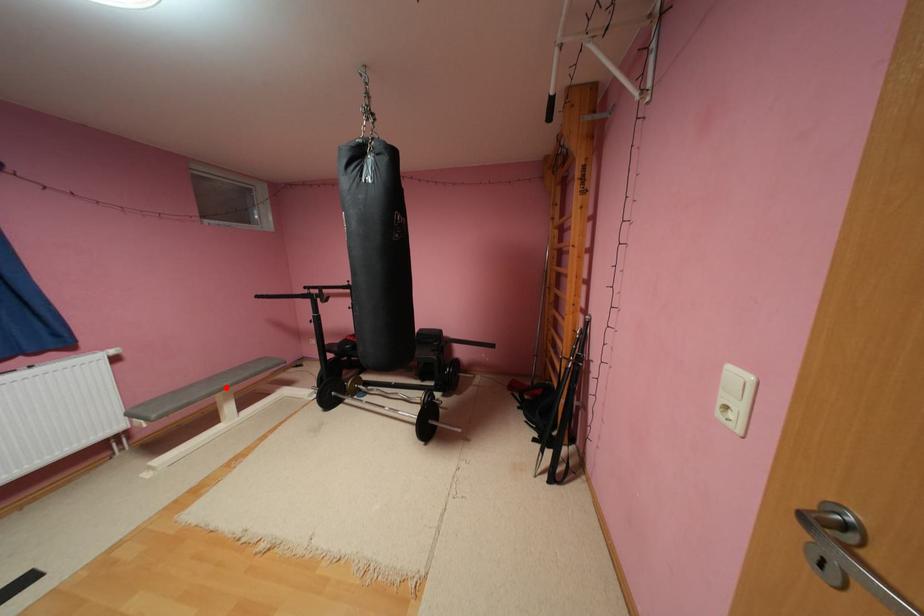
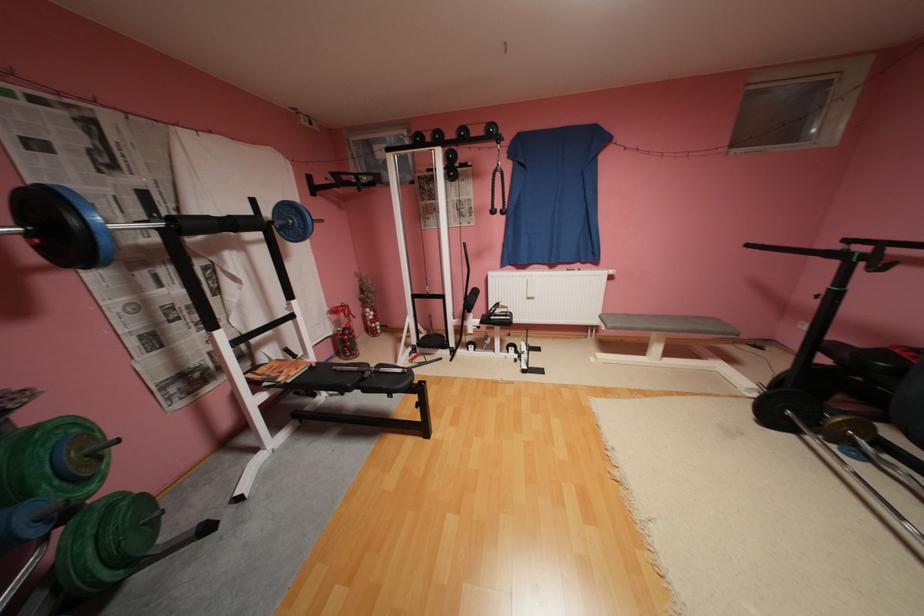
Find the pixel in the second image that matches the highlighted location in the first image.

(664, 326)